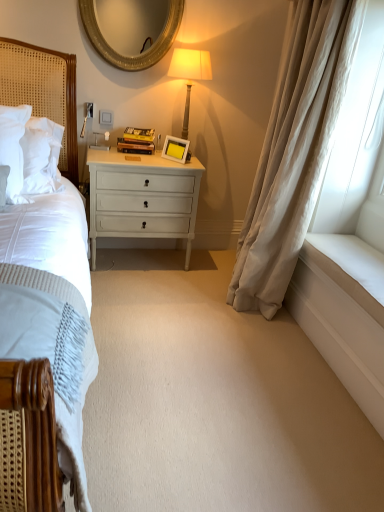
This screenshot has height=512, width=384. Find the location of `blank space to the left of white matte picture frame at center`. blank space to the left of white matte picture frame at center is located at coordinates coord(160,155).